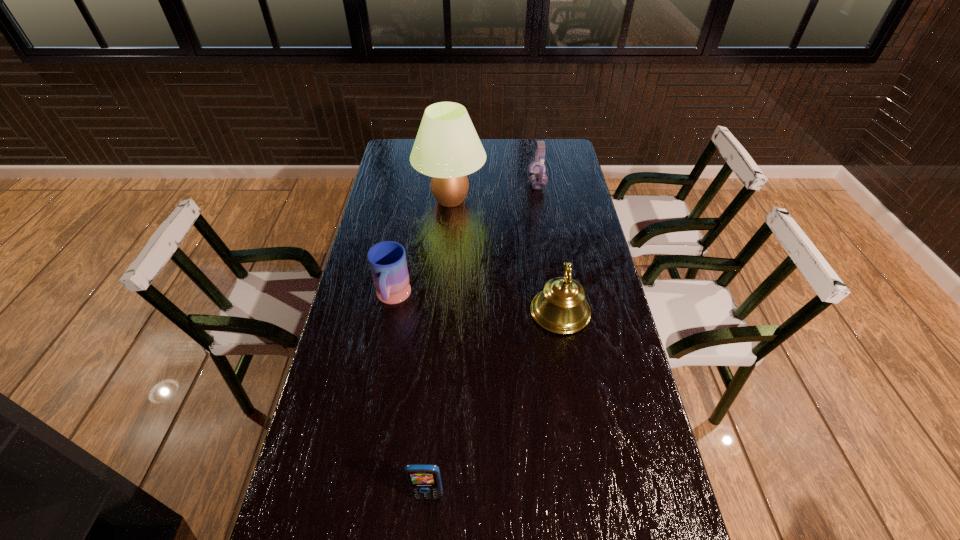
In order to click on vacant area in the image that satisfies the following two spatial constraints: 1. on the headband and ear cups of the bell; 2. on the left side of the headset in this screenshot , I will do `click(557, 312)`.